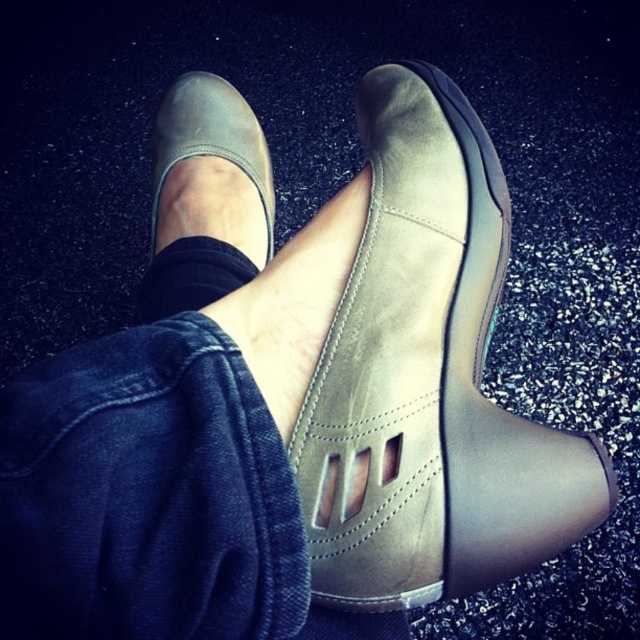
Does suede tan sandal at center have a lesser height compared to black suede ankle at center?

No.

Based on the photo, between suede tan sandal at center and black suede ankle at center, which one appears on the left side from the viewer's perspective?

Positioned to the left is black suede ankle at center.

Is point (564, 500) farther from viewer compared to point (211, 280)?

That is False.

The image size is (640, 640). Find the location of `suede tan sandal at center`. suede tan sandal at center is located at coordinates (428, 380).

Can you confirm if matte leather shoe at center is bigger than black suede ankle at center?

Indeed, matte leather shoe at center has a larger size compared to black suede ankle at center.

Who is more forward, (218, 93) or (211, 244)?

Point (211, 244) is in front.

At what (x,y) coordinates should I click in order to perform the action: click on matte leather shoe at center. Please return your answer as a coordinate pair (x, y). Looking at the image, I should click on (211, 136).

Between point (376, 317) and point (266, 209), which one is positioned in front?

Positioned in front is point (376, 317).

Can you confirm if suede tan sandal at center is positioned below matte leather shoe at center?

Yes, suede tan sandal at center is below matte leather shoe at center.

You are a GUI agent. You are given a task and a screenshot of the screen. Output one action in this format:
    pyautogui.click(x=<x>, y=<y>)
    Task: Click on the suede tan sandal at center
    Image resolution: width=640 pixels, height=640 pixels.
    Given the screenshot: What is the action you would take?
    pyautogui.click(x=428, y=380)

At what (x,y) coordinates should I click in order to perform the action: click on suede tan sandal at center. Please return your answer as a coordinate pair (x, y). Image resolution: width=640 pixels, height=640 pixels. Looking at the image, I should click on (428, 380).